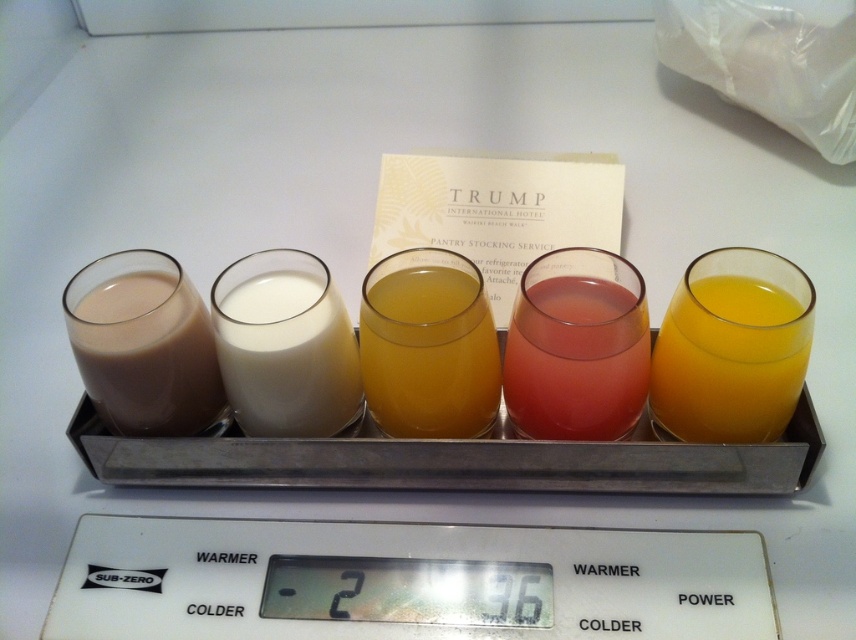
You are a delivery person who just placed a package on a point at coordinates point [446,269] in the Sub Zero refrigerator. The package is 12 inches thick. Will the package fit without protruding from the refrigerator?

The distance of point [446,269] from camera is 24.75 inches. Since the package is 12 inches thick, it will fit as 12 is less than 24.75.

You are organizing items in a refrigerator and need to place the white plastic scale at lower center and the matte brown liquid at left. Which item takes up more vertical space?

The matte brown liquid at left takes up more vertical space than the white plastic scale at lower center because the white plastic scale at lower center is not as tall as matte brown liquid at left.